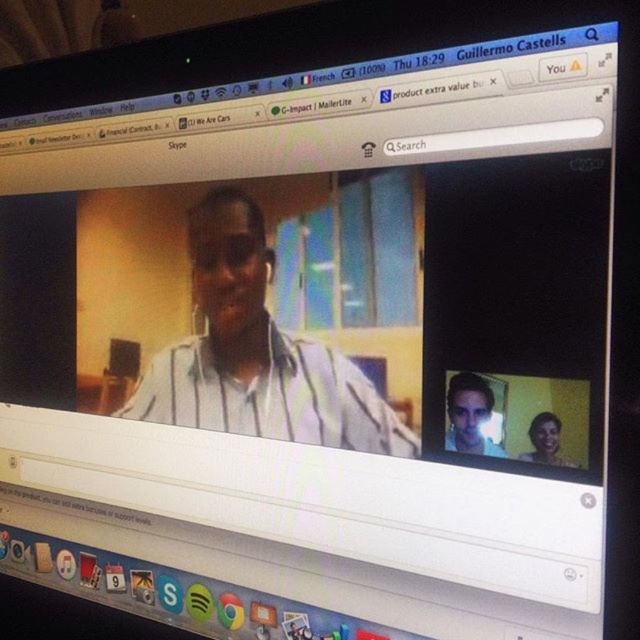
Question: Which point appears closest to the camera in this image?

Choices:
 (A) (282, 339)
 (B) (483, 444)
 (C) (534, 448)

Answer: (C)

Question: Does matte white shirt at upper right have a greater width compared to matte white shirt at lower right?

Choices:
 (A) no
 (B) yes

Answer: (B)

Question: Among these objects, which one is nearest to the camera?

Choices:
 (A) matte white shirt at lower right
 (B) white striped shirt at center
 (C) matte white shirt at upper right

Answer: (A)

Question: Where is white striped shirt at center located in relation to matte white shirt at lower right in the image?

Choices:
 (A) left
 (B) right

Answer: (A)

Question: Where is white striped shirt at center located in relation to matte white shirt at upper right in the image?

Choices:
 (A) above
 (B) below

Answer: (A)

Question: Which object appears farthest from the camera in this image?

Choices:
 (A) matte white shirt at upper right
 (B) matte white shirt at lower right
 (C) white striped shirt at center

Answer: (C)